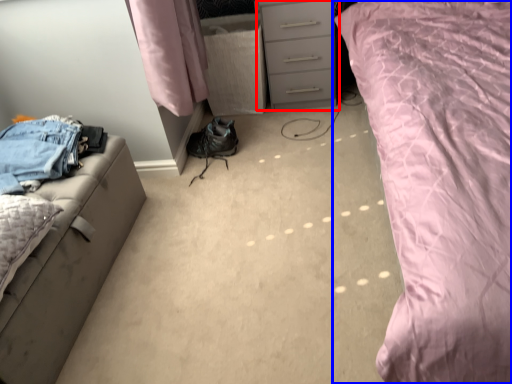
Question: Which object appears closest to the camera in this image, chest of drawers (highlighted by a red box) or bed (highlighted by a blue box)?

Choices:
 (A) chest of drawers
 (B) bed

Answer: (B)